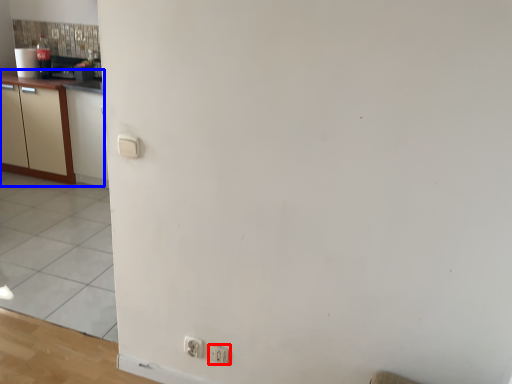
Question: Among these objects, which one is nearest to the camera, electric outlet (highlighted by a red box) or cabinetry (highlighted by a blue box)?

Choices:
 (A) electric outlet
 (B) cabinetry

Answer: (A)